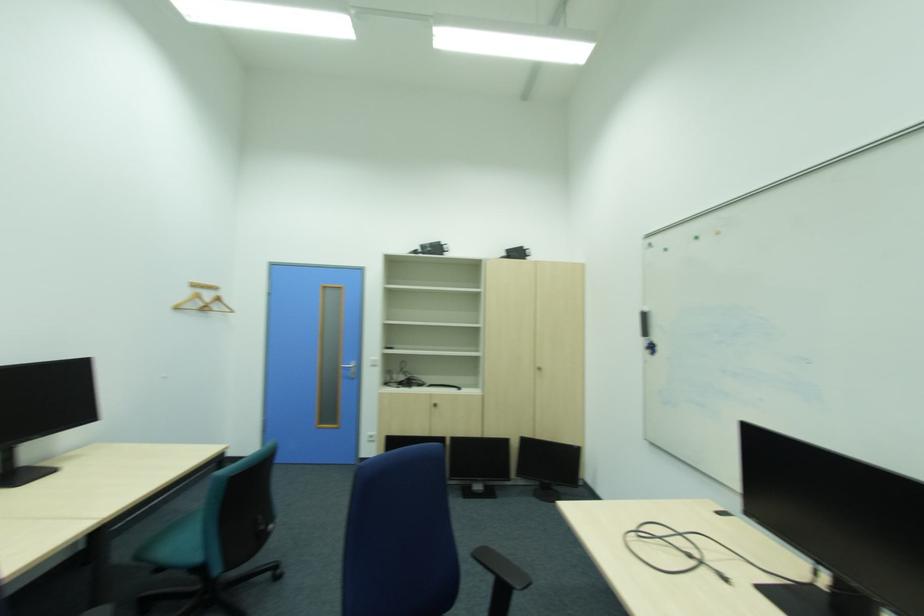
Identify the location of silver door handle. (349, 367).